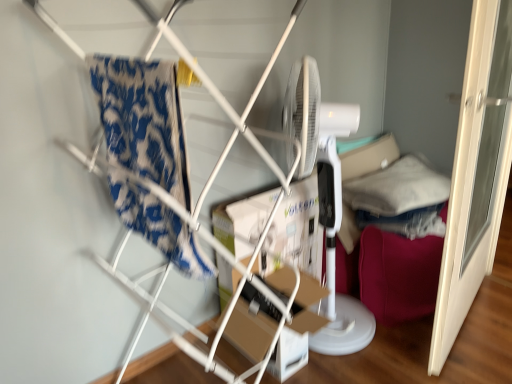
Question: Is soft white pillow at right in contact with white plastic mechanical fan at right?

Choices:
 (A) no
 (B) yes

Answer: (A)

Question: Is soft white pillow at right facing towards white plastic mechanical fan at right?

Choices:
 (A) yes
 (B) no

Answer: (B)

Question: Does soft white pillow at right have a lesser height compared to white plastic mechanical fan at right?

Choices:
 (A) yes
 (B) no

Answer: (A)

Question: From a real-world perspective, is soft white pillow at right on white plastic mechanical fan at right?

Choices:
 (A) no
 (B) yes

Answer: (A)

Question: Does soft white pillow at right have a lesser width compared to white plastic mechanical fan at right?

Choices:
 (A) yes
 (B) no

Answer: (B)

Question: From the image's perspective, is blue patterned fabric at left positioned above or below velvet pink bean bag chair at right?

Choices:
 (A) above
 (B) below

Answer: (A)

Question: From a real-world perspective, is blue patterned fabric at left above or below velvet pink bean bag chair at right?

Choices:
 (A) below
 (B) above

Answer: (B)

Question: Considering the positions of blue patterned fabric at left and velvet pink bean bag chair at right in the image, is blue patterned fabric at left taller or shorter than velvet pink bean bag chair at right?

Choices:
 (A) short
 (B) tall

Answer: (B)

Question: Would you say blue patterned fabric at left is to the left or to the right of velvet pink bean bag chair at right in the picture?

Choices:
 (A) right
 (B) left

Answer: (B)

Question: From the image's perspective, is soft white pillow at right positioned above or below white plastic mechanical fan at right?

Choices:
 (A) below
 (B) above

Answer: (B)

Question: Which is correct: soft white pillow at right is inside white plastic mechanical fan at right, or outside of it?

Choices:
 (A) outside
 (B) inside

Answer: (A)

Question: From their relative heights in the image, would you say soft white pillow at right is taller or shorter than white plastic mechanical fan at right?

Choices:
 (A) short
 (B) tall

Answer: (A)

Question: Considering the positions of point (441, 183) and point (335, 314), is point (441, 183) closer or farther from the camera than point (335, 314)?

Choices:
 (A) closer
 (B) farther

Answer: (B)

Question: Is point (361, 309) positioned closer to the camera than point (286, 374)?

Choices:
 (A) closer
 (B) farther

Answer: (B)

Question: Is white plastic mechanical fan at right bigger or smaller than cardboard box at center?

Choices:
 (A) big
 (B) small

Answer: (A)